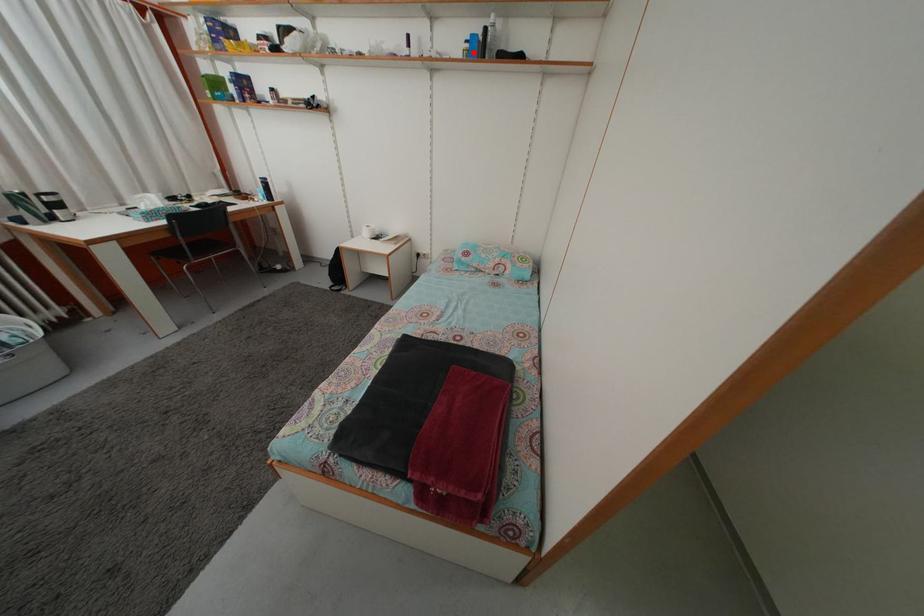
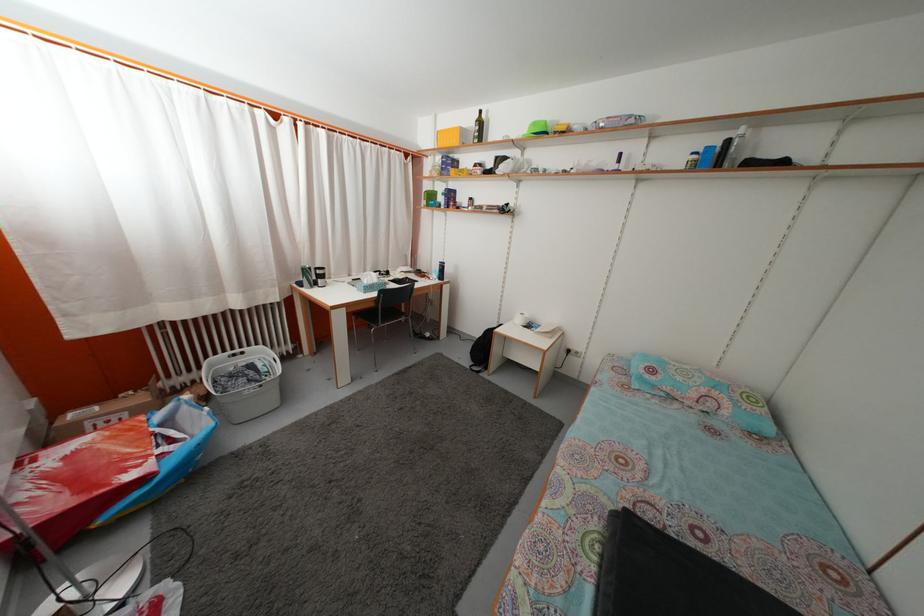
In the second image, find the point that corresponds to the highlighted location in the first image.

(699, 164)